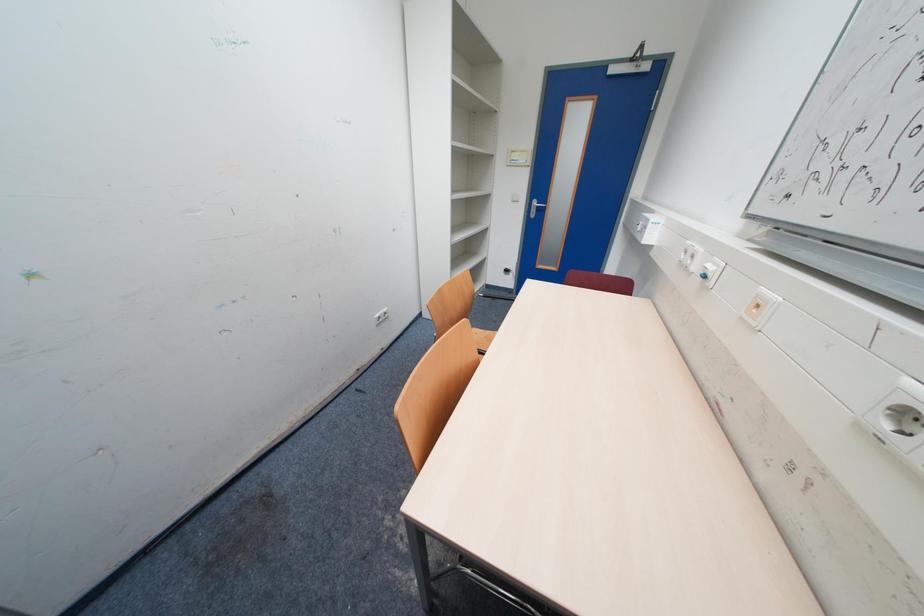
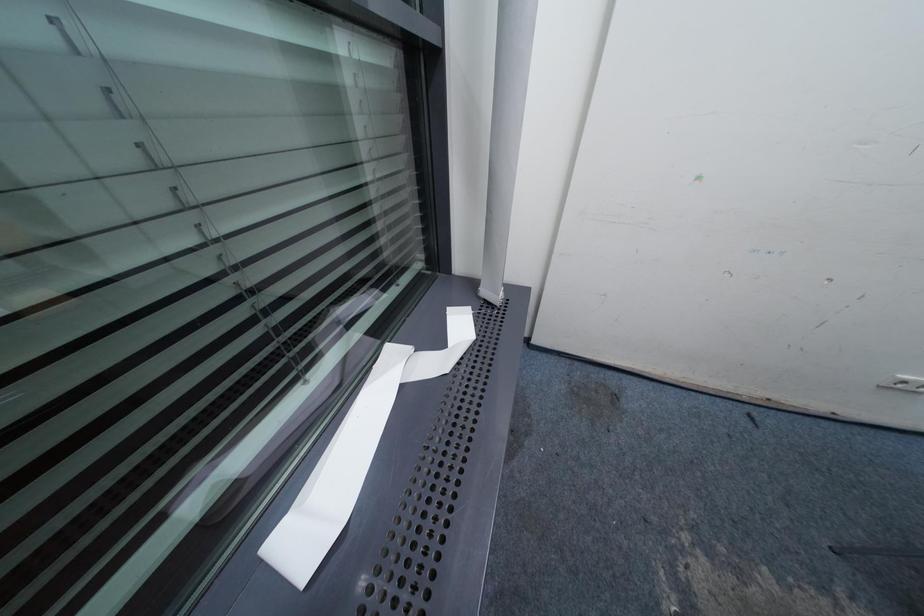
How did the camera likely rotate?

The camera's rotation is toward left-down.